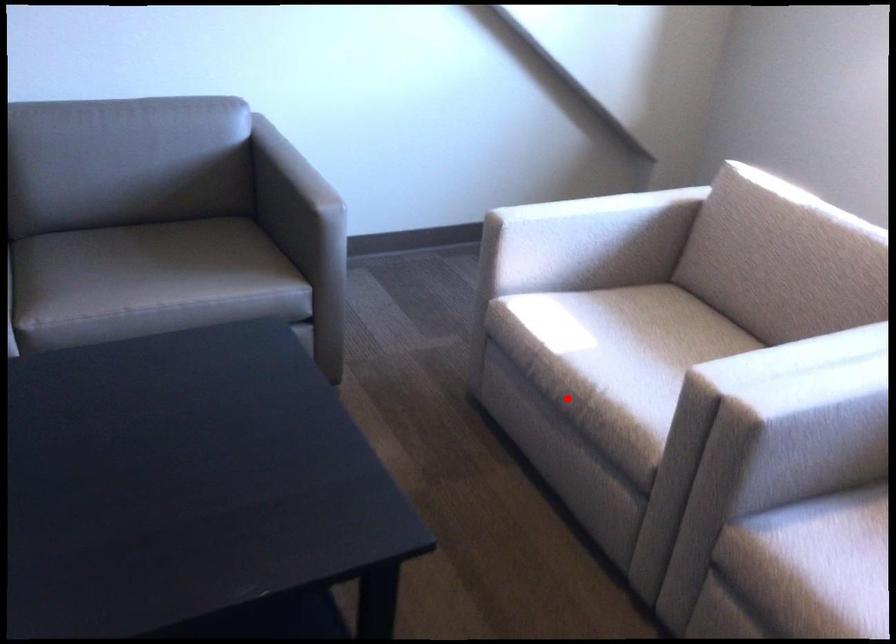
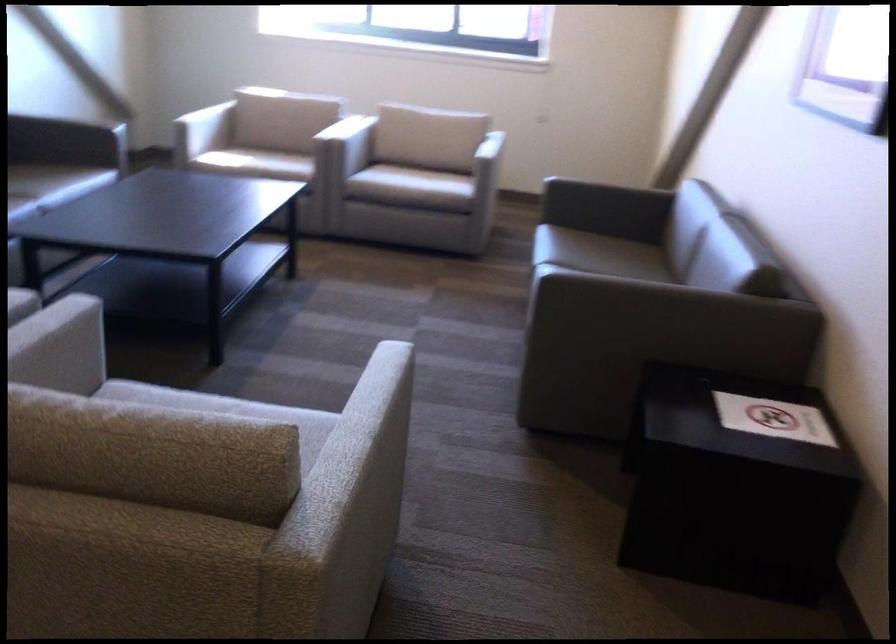
Question: I am providing you with two images of the same scene from different viewpoints. Given a red point in image1, look at the same physical point in image2. Is it:

Choices:
 (A) Closer to the viewpoint
 (B) Farther from the viewpoint

Answer: (B)